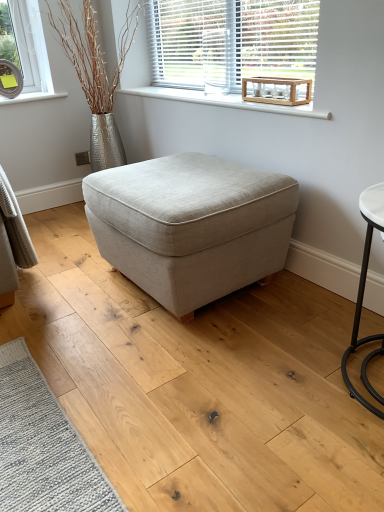
Measure the distance between white smooth window sill at upper center and camera.

The depth of white smooth window sill at upper center is 1.46 meters.

In order to click on white smooth window sill at upper center in this screenshot , I will do `click(225, 101)`.

From a real-world perspective, is beige fabric ottoman at center on top of wooden crate at upper center?

No, from a real-world perspective, beige fabric ottoman at center is not on top of wooden crate at upper center.

Consider the image. Considering the relative positions of beige fabric ottoman at center and wooden crate at upper center in the image provided, is beige fabric ottoman at center to the left of wooden crate at upper center from the viewer's perspective?

Indeed, beige fabric ottoman at center is positioned on the left side of wooden crate at upper center.

Can you see beige fabric ottoman at center touching wooden crate at upper center?

No, beige fabric ottoman at center is not next to wooden crate at upper center.

Can you confirm if beige fabric ottoman at center is smaller than wooden crate at upper center?

Incorrect, beige fabric ottoman at center is not smaller in size than wooden crate at upper center.

Is clear glass round table at upper right inside beige fabric ottoman at center?

No, clear glass round table at upper right is not inside beige fabric ottoman at center.

From the image's perspective, which one is positioned lower, beige fabric ottoman at center or clear glass round table at upper right?

From the image's view, beige fabric ottoman at center is below.

Which is more to the right, beige fabric ottoman at center or clear glass round table at upper right?

From the viewer's perspective, clear glass round table at upper right appears more on the right side.

Which is farther from the camera, (228, 246) or (295, 94)?

The point (295, 94) is farther.

Looking at this image, how different are the orientations of wooden crate at upper center and beige fabric ottoman at center in degrees?

There is a 0.312-degree angle between the facing directions of wooden crate at upper center and beige fabric ottoman at center.

Which object is more forward, wooden crate at upper center or beige fabric ottoman at center?

beige fabric ottoman at center is more forward.

Is wooden crate at upper center oriented towards beige fabric ottoman at center?

No, wooden crate at upper center is not turned towards beige fabric ottoman at center.

How distant is wooden crate at upper center from beige fabric ottoman at center?

wooden crate at upper center and beige fabric ottoman at center are 32.06 inches apart from each other.

Is white smooth window sill at upper center touching wooden crate at upper center?

white smooth window sill at upper center and wooden crate at upper center are not in contact.

Is the depth of white smooth window sill at upper center greater than that of wooden crate at upper center?

No, it is not.

Considering the relative sizes of white smooth window sill at upper center and wooden crate at upper center in the image provided, is white smooth window sill at upper center shorter than wooden crate at upper center?

Yes, white smooth window sill at upper center is shorter than wooden crate at upper center.

From the image's perspective, is clear glass round table at upper right under wooden crate at upper center?

Correct, clear glass round table at upper right appears lower than wooden crate at upper center in the image.

Locate an element on the screen. round table below the wooden crate at upper center (from a real-world perspective) is located at coordinates (277, 91).

Visually, is clear glass round table at upper right positioned to the left or to the right of wooden crate at upper center?

clear glass round table at upper right is to the right of wooden crate at upper center.

Looking at this image, can you confirm if beige fabric ottoman at center is positioned to the left of white smooth window sill at upper center?

Correct, you'll find beige fabric ottoman at center to the left of white smooth window sill at upper center.

In terms of height, does beige fabric ottoman at center look taller or shorter compared to white smooth window sill at upper center?

In the image, beige fabric ottoman at center appears to be taller than white smooth window sill at upper center.

Which of these two, beige fabric ottoman at center or white smooth window sill at upper center, is bigger?

beige fabric ottoman at center.

Locate an element on the screen. The image size is (384, 512). window above the white smooth window sill at upper center (from a real-world perspective) is located at coordinates (231, 41).

Do you think wooden crate at upper center is within white smooth window sill at upper center, or outside of it?

wooden crate at upper center is spatially situated outside white smooth window sill at upper center.

In the scene shown: Is wooden crate at upper center smaller than white smooth window sill at upper center?

Actually, wooden crate at upper center might be larger than white smooth window sill at upper center.

Are wooden crate at upper center and white smooth window sill at upper center located far from each other?

No.

The image size is (384, 512). Identify the location of music stool below the wooden crate at upper center (from the image's perspective). (191, 225).

Find the location of a particular element. The image size is (384, 512). round table above the beige fabric ottoman at center (from a real-world perspective) is located at coordinates (277, 91).

Based on their spatial positions, is beige fabric ottoman at center or white smooth window sill at upper center further from wooden crate at upper center?

beige fabric ottoman at center is further to wooden crate at upper center.

Estimate the real-world distances between objects in this image. Which object is closer to clear glass round table at upper right, wooden crate at upper center or beige fabric ottoman at center?

wooden crate at upper center is positioned closer to the anchor clear glass round table at upper right.

Which object lies nearer to the anchor point wooden crate at upper center, beige fabric ottoman at center or clear glass round table at upper right?

Based on the image, clear glass round table at upper right appears to be nearer to wooden crate at upper center.

Estimate the real-world distances between objects in this image. Which object is closer to clear glass round table at upper right, white smooth window sill at upper center or wooden crate at upper center?

The object closer to clear glass round table at upper right is white smooth window sill at upper center.

From the image, which object appears to be nearer to beige fabric ottoman at center, wooden crate at upper center or clear glass round table at upper right?

clear glass round table at upper right.

From the image, which object appears to be nearer to clear glass round table at upper right, white smooth window sill at upper center or beige fabric ottoman at center?

white smooth window sill at upper center is positioned closer to the anchor clear glass round table at upper right.

When comparing their distances from beige fabric ottoman at center, does white smooth window sill at upper center or clear glass round table at upper right seem further?

clear glass round table at upper right lies further to beige fabric ottoman at center than the other object.

Estimate the real-world distances between objects in this image. Which object is closer to wooden crate at upper center, clear glass round table at upper right or beige fabric ottoman at center?

→ clear glass round table at upper right lies closer to wooden crate at upper center than the other object.

Locate an element on the screen. The width and height of the screenshot is (384, 512). window sill between wooden crate at upper center and clear glass round table at upper right vertically is located at coordinates (225, 101).

You are a GUI agent. You are given a task and a screenshot of the screen. Output one action in this format:
    pyautogui.click(x=<x>, y=<y>)
    Task: Click on the round table between white smooth window sill at upper center and beige fabric ottoman at center from top to bottom
    The image size is (384, 512).
    Given the screenshot: What is the action you would take?
    pyautogui.click(x=277, y=91)

This screenshot has height=512, width=384. Find the location of `window sill between wooden crate at upper center and beige fabric ottoman at center from top to bottom`. window sill between wooden crate at upper center and beige fabric ottoman at center from top to bottom is located at coordinates (225, 101).

You are a GUI agent. You are given a task and a screenshot of the screen. Output one action in this format:
    pyautogui.click(x=<x>, y=<y>)
    Task: Click on the round table between wooden crate at upper center and beige fabric ottoman at center vertically
    The height and width of the screenshot is (512, 384).
    Given the screenshot: What is the action you would take?
    pyautogui.click(x=277, y=91)